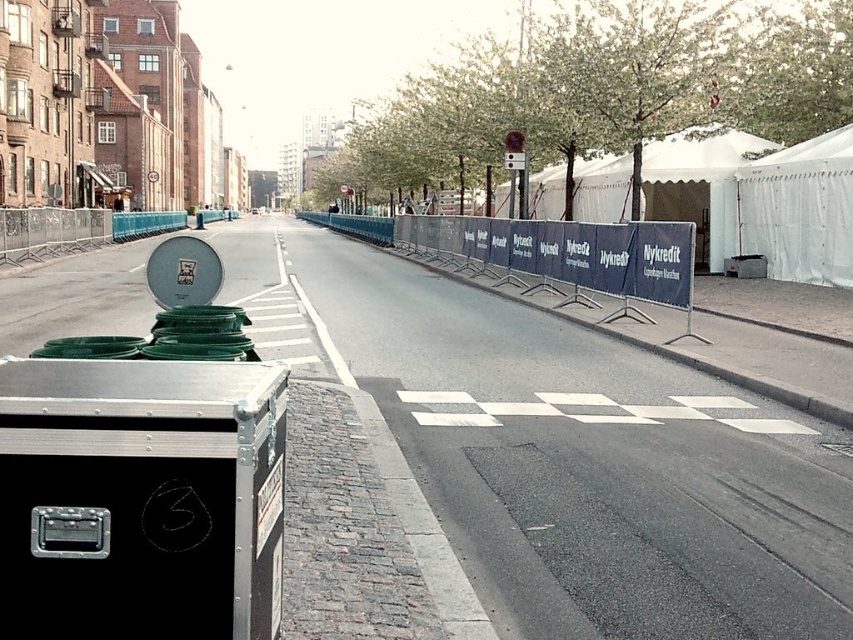
You are standing on the street in the image and want to walk from point [653,177] to point [817,202]. Which direction should you face to move towards the latter point?

Since point [653,177] is closer to you than point [817,202], you should face away from the buildings to move towards the latter point.

You are standing at the start line of the event and want to position a new banner exactly at the center of the blue fabric barrier at center. What are the coordinates where you should place the banner?

The blue fabric barrier at center is located at coordinates point (x=548, y=256), so you should place the banner at those coordinates.